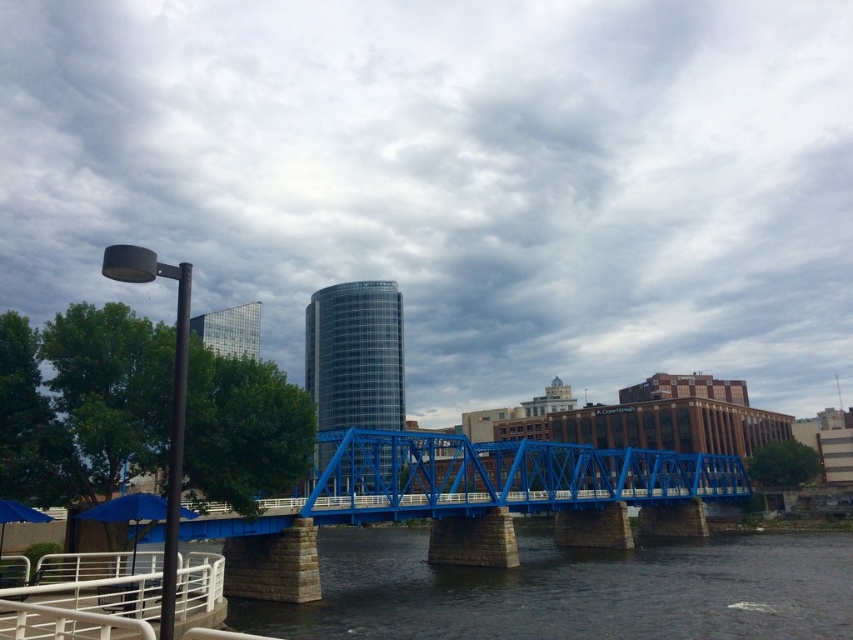
Question: Can you confirm if dark gray stone river at center is positioned to the right of blue metallic bridge at center?

Choices:
 (A) yes
 (B) no

Answer: (A)

Question: Can you confirm if dark gray stone river at center is smaller than blue metallic bridge at center?

Choices:
 (A) yes
 (B) no

Answer: (B)

Question: Which point is closer to the camera?

Choices:
 (A) (566, 484)
 (B) (265, 608)

Answer: (B)

Question: Is dark gray stone river at center positioned at the back of blue metallic bridge at center?

Choices:
 (A) yes
 (B) no

Answer: (B)

Question: Which object is closer to the camera taking this photo?

Choices:
 (A) dark gray stone river at center
 (B) blue metallic bridge at center

Answer: (A)